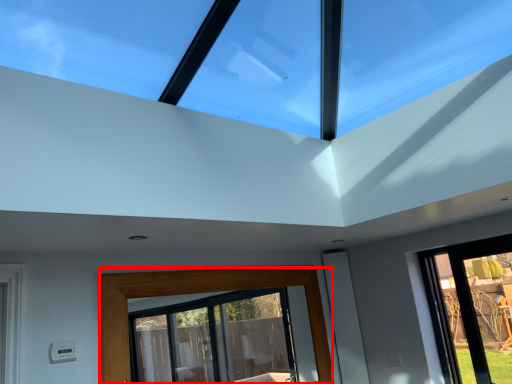
Question: From the image's perspective, what is the correct spatial relationship of window (annotated by the red box) in relation to window?

Choices:
 (A) below
 (B) above

Answer: (A)